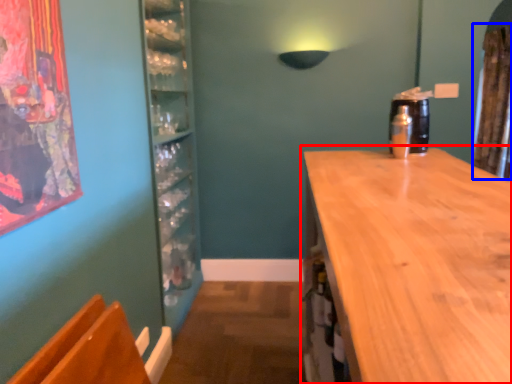
Question: Which point is closer to the camera, countertop (highlighted by a red box) or curtain (highlighted by a blue box)?

Choices:
 (A) countertop
 (B) curtain

Answer: (A)